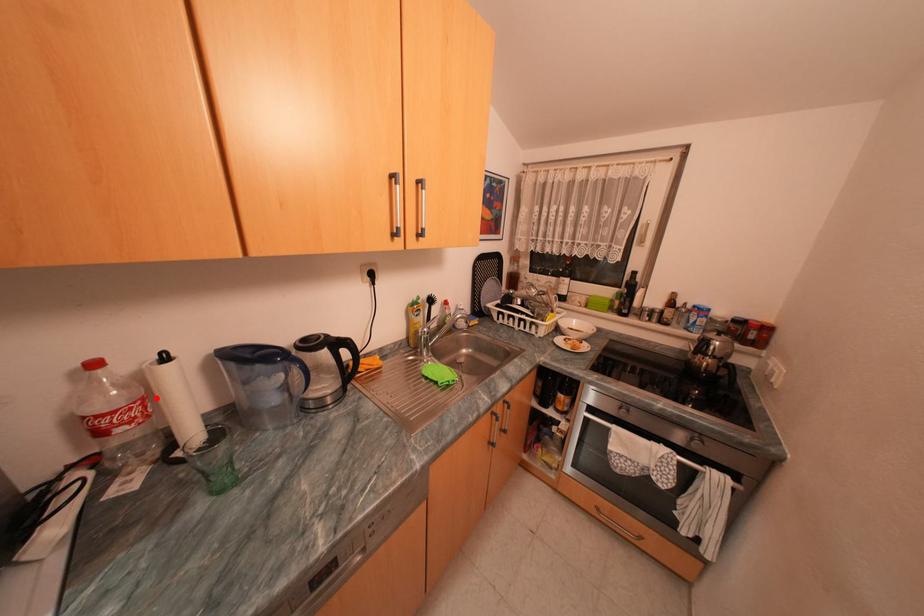
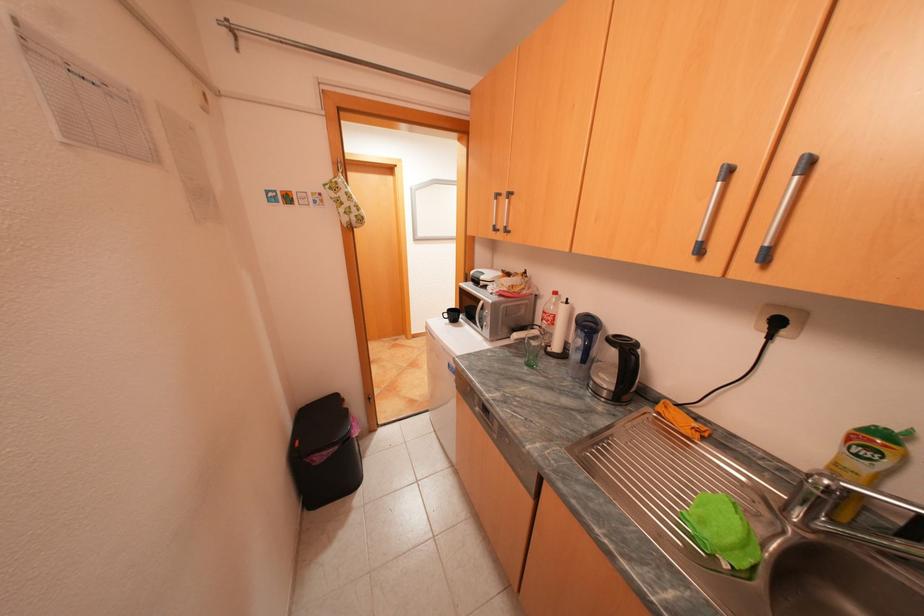
The point at the highlighted location is marked in the first image. Where is the corresponding point in the second image?

(565, 315)